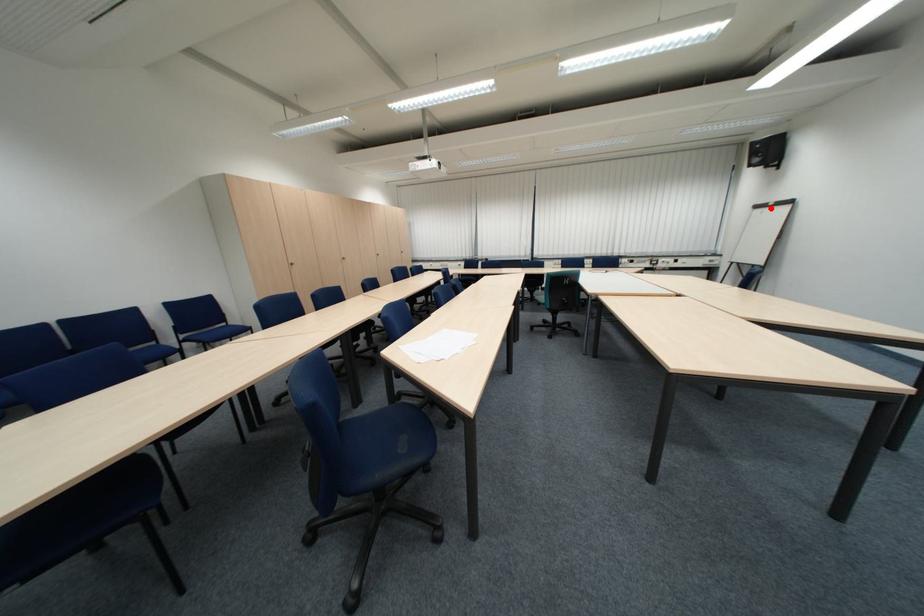
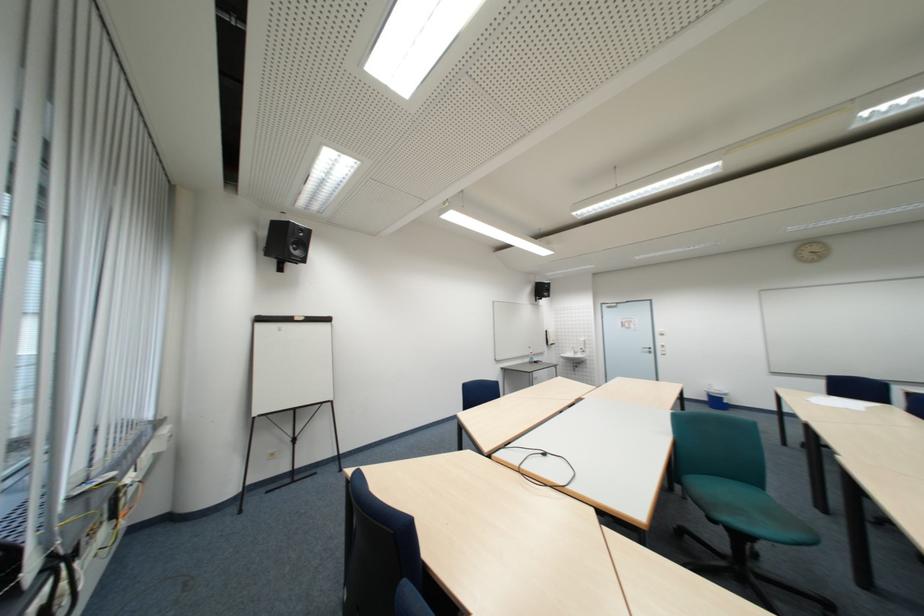
Locate, in the second image, the point that corresponds to the highlighted location in the first image.

(273, 321)